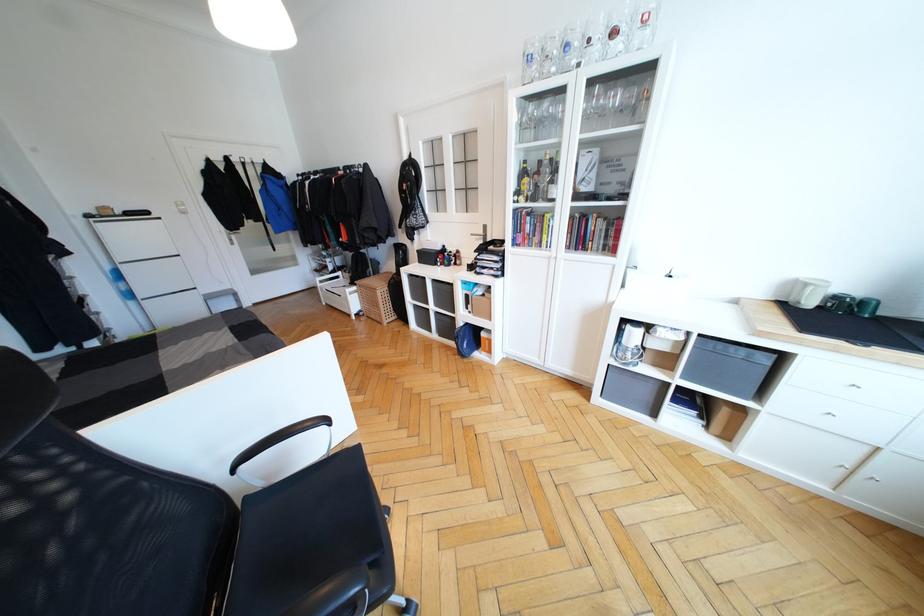
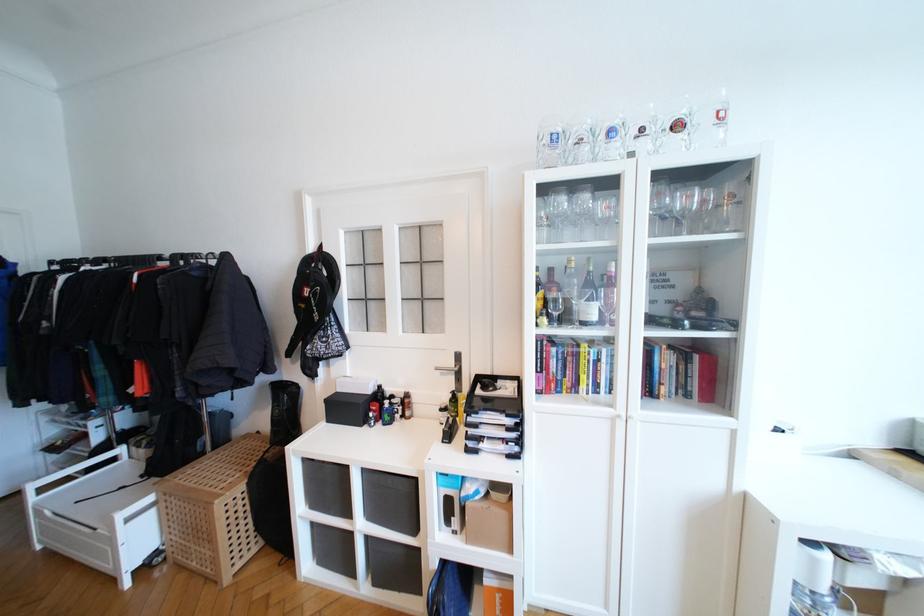
The point at (532, 195) is marked in the first image. Where is the corresponding point in the second image?

(558, 315)